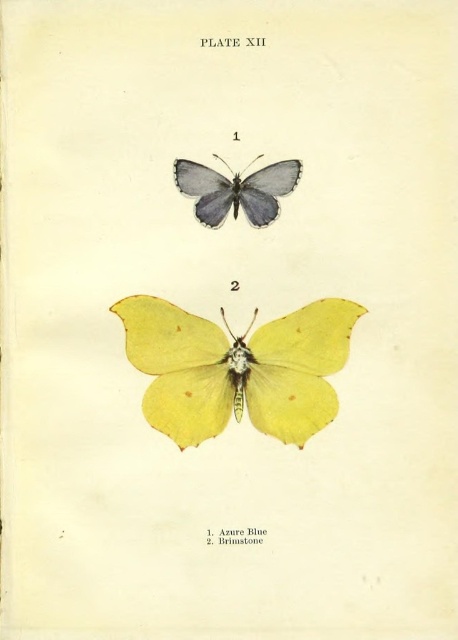
You are holding a ruler that is 12 inches long. You want to measure the distance between yourself and the matte yellow butterfly at lower center shown in the image. Can your ruler reach that distance?

The distance between the matte yellow butterfly at lower center and the viewer is 4.05 feet. Since the ruler is only 12 inches long, which is equivalent to 1 foot, the ruler cannot reach the required distance of 4.05 feet.

You are an entomologist examining the butterflies in Plate XII of this natural history book. You need to determine which butterfly has a greater wingspan. Which one is wider between the matte yellow butterfly at lower center and the matte azure blue butterfly at upper center?

The matte yellow butterfly at lower center has a greater wingspan because its width is larger than that of the matte azure blue butterfly at upper center.